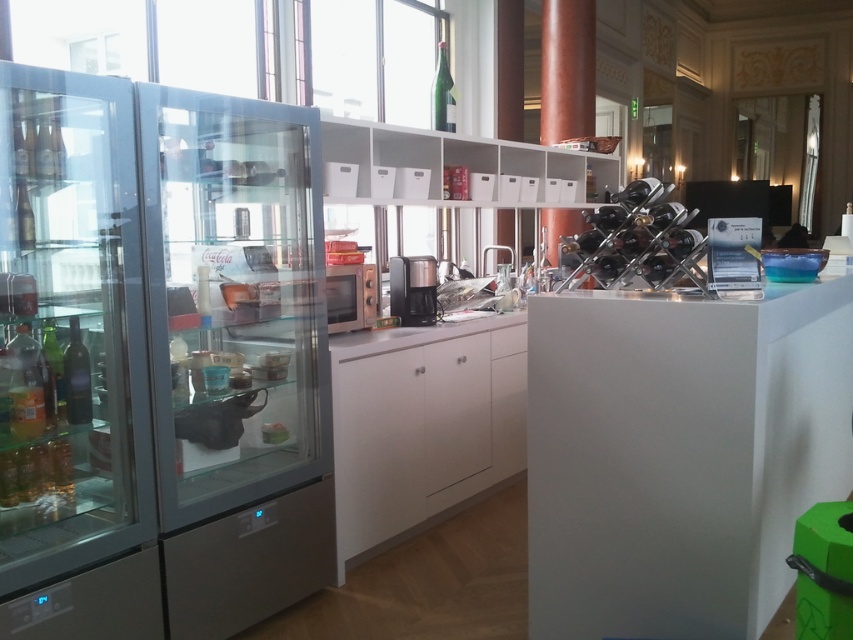
Consider the image. Does transparent glass door at left have a greater width compared to transparent glass fridge at left?

Yes, transparent glass door at left is wider than transparent glass fridge at left.

Is point (160, 291) closer to camera compared to point (35, 262)?

No, it is behind (35, 262).

Locate an element on the screen. The height and width of the screenshot is (640, 853). transparent glass door at left is located at coordinates (236, 355).

Find the location of `black plastic coffee maker at center`. black plastic coffee maker at center is located at coordinates (413, 289).

You are a GUI agent. You are given a task and a screenshot of the screen. Output one action in this format:
    pyautogui.click(x=<x>, y=<y>)
    Task: Click on the black plastic coffee maker at center
    
    Given the screenshot: What is the action you would take?
    pyautogui.click(x=413, y=289)

Find the location of a particular element. black plastic coffee maker at center is located at coordinates (413, 289).

Can you confirm if transparent glass door at left is thinner than black plastic coffee maker at center?

In fact, transparent glass door at left might be wider than black plastic coffee maker at center.

Describe the element at coordinates (236, 355) in the screenshot. I see `transparent glass door at left` at that location.

Is point (161, 236) positioned after point (392, 310)?

No.

Where is `transparent glass door at left`? The image size is (853, 640). transparent glass door at left is located at coordinates (236, 355).